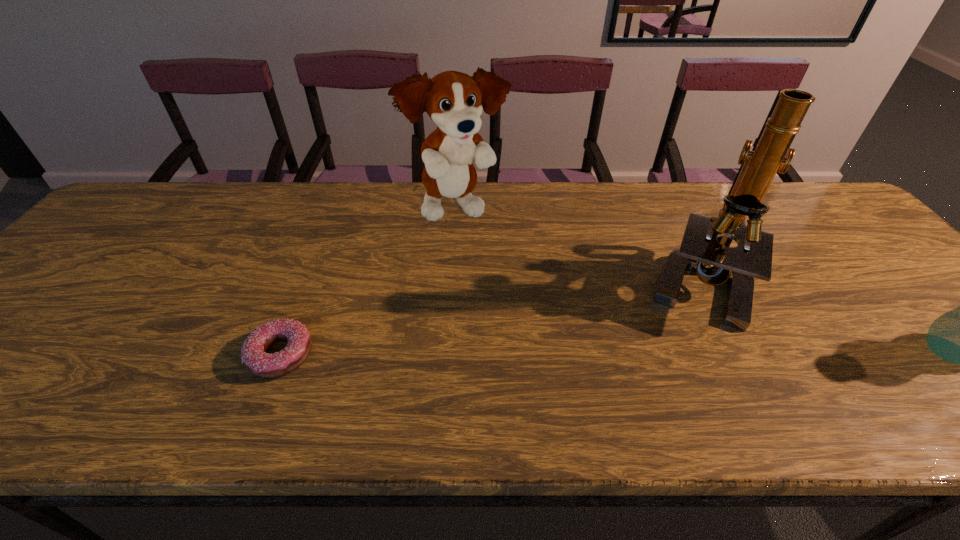
Locate an element on the screen. This screenshot has height=540, width=960. vacant area that lies between the microscope and the second tallest object is located at coordinates (577, 246).

What are the coordinates of `vacant space that's between the doughnut and the third object from left to right` in the screenshot? It's located at (489, 319).

In order to click on free space between the second object from left to right and the third object from left to right in this screenshot , I will do `click(577, 246)`.

The width and height of the screenshot is (960, 540). What are the coordinates of `object that ranks as the third closest to the third tallest object` in the screenshot? It's located at (253, 352).

I want to click on object that stands as the closest to the microscope, so click(x=959, y=336).